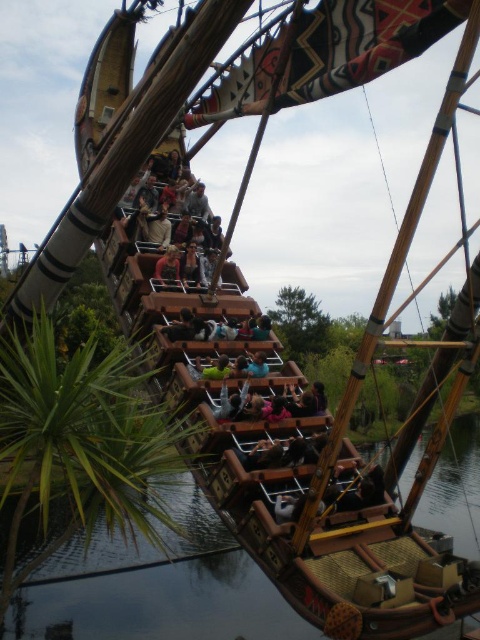
You are standing at the base of the pirate ship roller coaster and see the point marked at coordinates point (x=160, y=205). If you want to throw a water balloon to hit that exact point, considering the distance, would you need to throw it with extra force compared to a typical throw? Explain using the given information.

The point (x=160, y=205) is 287.85 feet away from the viewer. Since this distance is significantly longer than a typical throw range, you would need to throw the water balloon with extra force to reach that point.

You are a safety inspector evaluating the pirate ship roller coaster. You notice the transparent water at lower center and the wooden plank at center. According to safety guidelines, the water must be at least as high as the wooden plank to prevent dehydration of the coaster wheels. Is there a safety concern here?

The transparent water at lower center is shorter than the wooden plank at center, which means the water level is below the required height. This creates a safety concern as it may lead to dehydration of the coaster wheels.